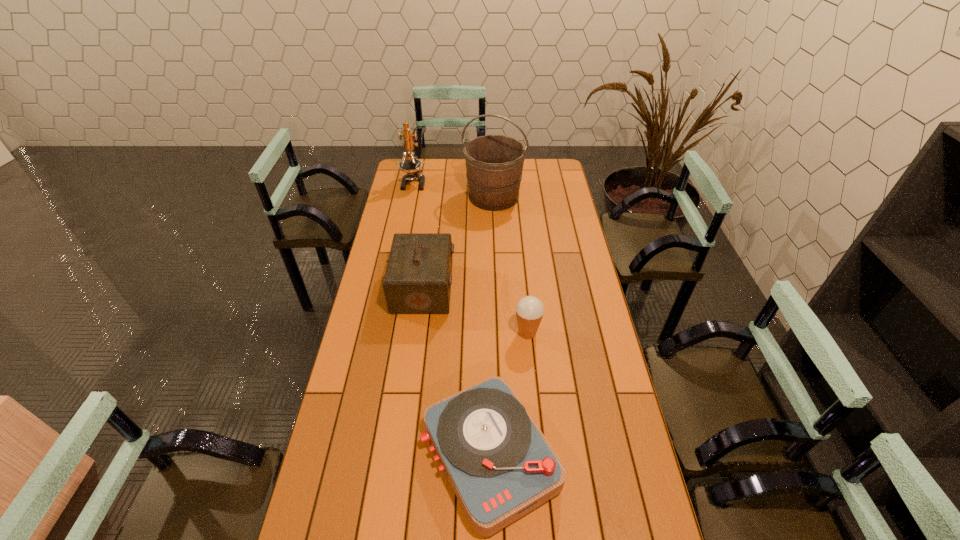
Where is `free point located on the back of the third nearest object`? The width and height of the screenshot is (960, 540). free point located on the back of the third nearest object is located at coordinates (432, 219).

Identify the location of free point located 0.230m on the back of the icecream. This screenshot has width=960, height=540. pos(522,278).

The height and width of the screenshot is (540, 960). What are the coordinates of `vacant space located on the back of the shortest object` in the screenshot? It's located at (488, 367).

Locate an element on the screen. This screenshot has height=540, width=960. bucket that is at the far edge is located at coordinates (494, 163).

At what (x,y) coordinates should I click in order to perform the action: click on microscope present at the far edge. Please return your answer as a coordinate pair (x, y). The height and width of the screenshot is (540, 960). Looking at the image, I should click on (412, 166).

This screenshot has width=960, height=540. I want to click on microscope located at the left edge, so click(412, 166).

This screenshot has height=540, width=960. I want to click on the first-aid kit at the left edge, so click(x=418, y=278).

This screenshot has height=540, width=960. I want to click on object located in the far left corner section of the desktop, so click(x=412, y=166).

Locate an element on the screen. The width and height of the screenshot is (960, 540). vacant space at the far edge of the desktop is located at coordinates (451, 159).

This screenshot has width=960, height=540. I want to click on free space at the left edge, so click(374, 260).